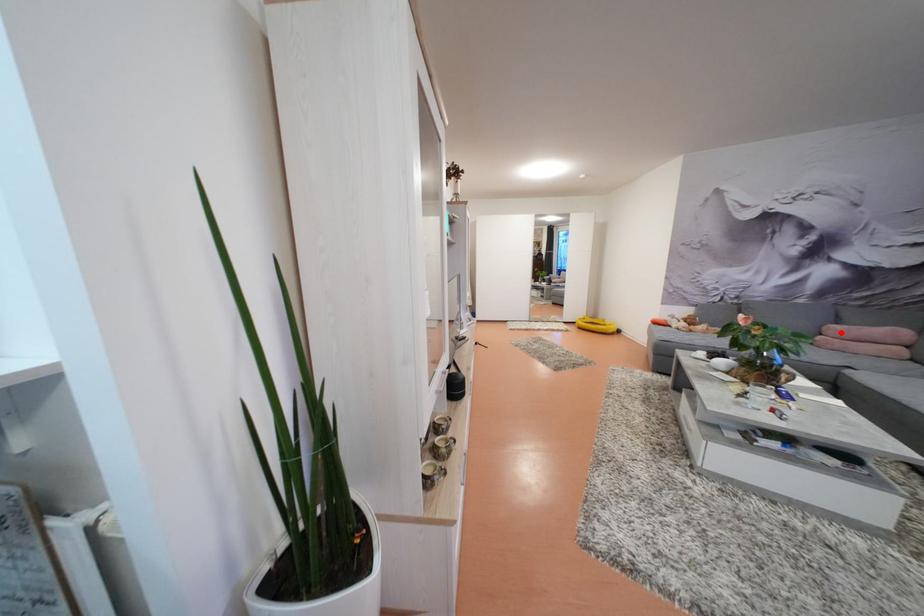
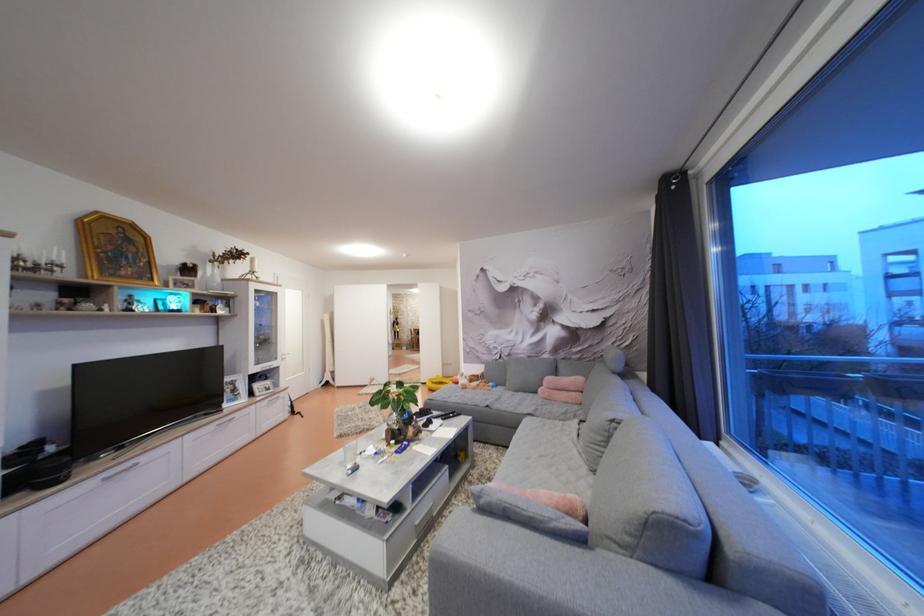
In the second image, find the point that corresponds to the highlighted location in the first image.

(556, 384)